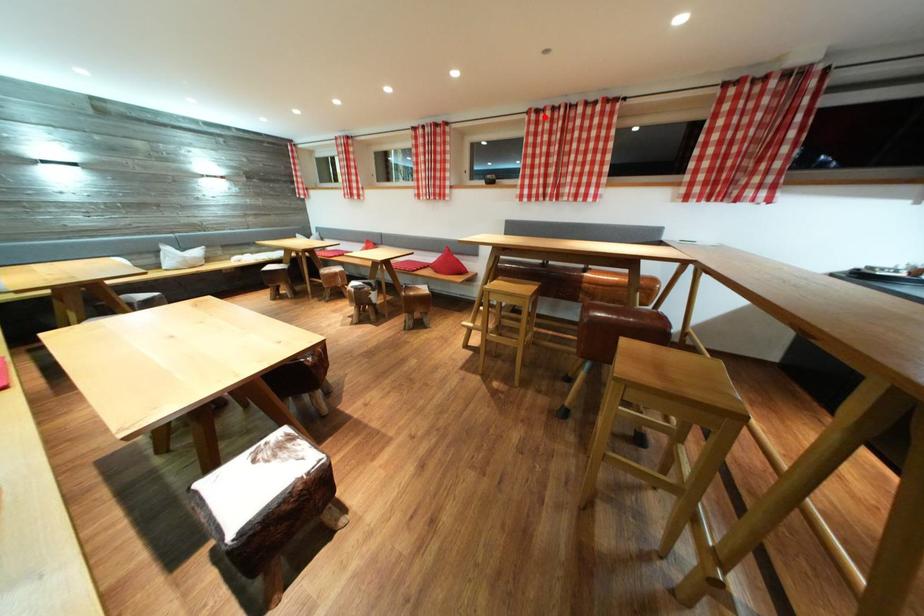
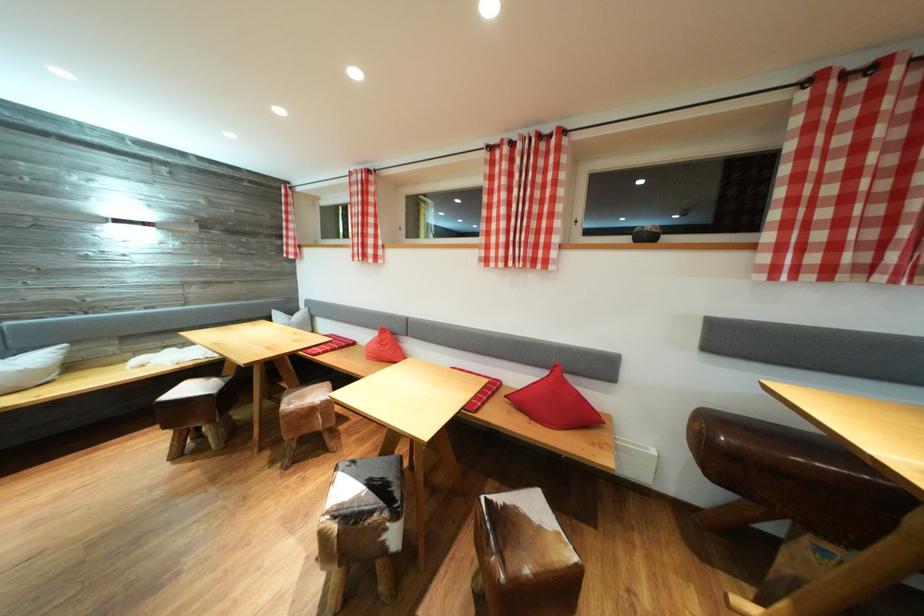
In the second image, find the point that corresponds to the highlighted location in the first image.

(852, 81)